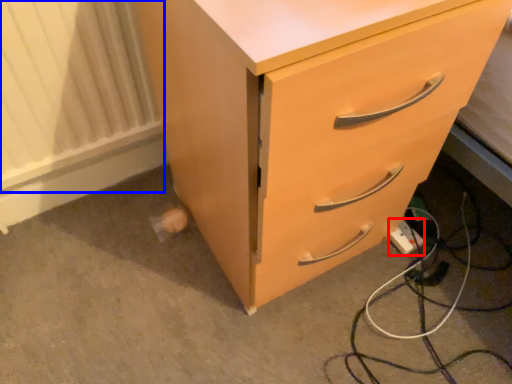
Question: Which point is closer to the camera, extension cord (highlighted by a red box) or radiator (highlighted by a blue box)?

Choices:
 (A) extension cord
 (B) radiator

Answer: (B)